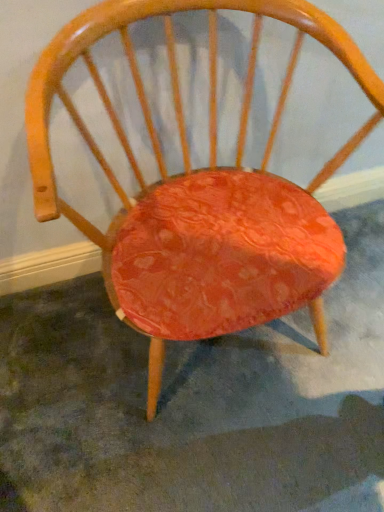
Locate an element on the screen. orange fabric cushion at center is located at coordinates (197, 403).

What do you see at coordinates (197, 403) in the screenshot? This screenshot has width=384, height=512. I see `orange fabric cushion at center` at bounding box center [197, 403].

I want to click on orange fabric cushion at center, so click(197, 403).